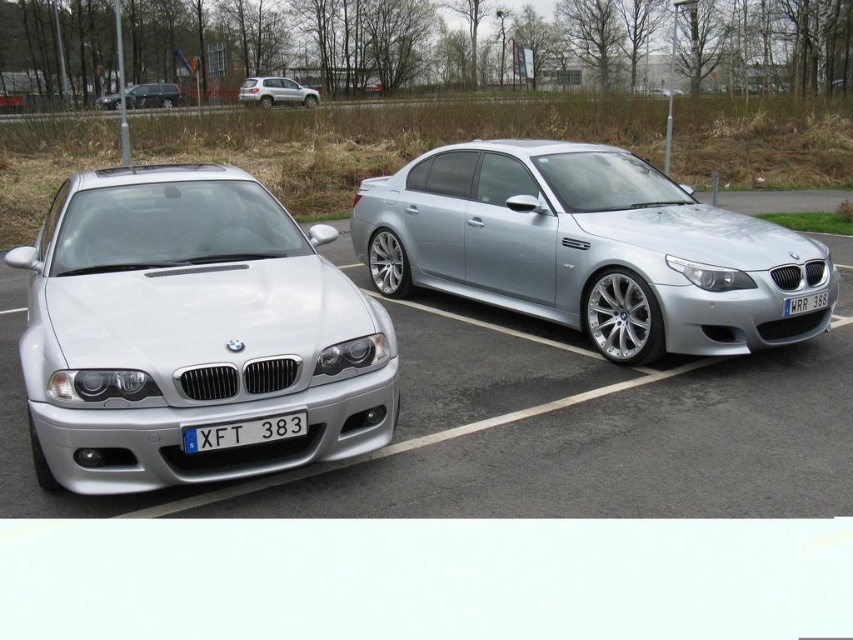
Is satin silver sedan at center shorter than blue metallic license plate at lower center?

In fact, satin silver sedan at center may be taller than blue metallic license plate at lower center.

The width and height of the screenshot is (853, 640). What do you see at coordinates (589, 248) in the screenshot? I see `satin silver sedan at center` at bounding box center [589, 248].

You are a GUI agent. You are given a task and a screenshot of the screen. Output one action in this format:
    pyautogui.click(x=<x>, y=<y>)
    Task: Click on the satin silver sedan at center
    The image size is (853, 640).
    Given the screenshot: What is the action you would take?
    pyautogui.click(x=589, y=248)

What are the coordinates of `satin silver sedan at center` in the screenshot? It's located at (589, 248).

Between point (187, 449) and point (306, 97), which one is positioned behind?

The point (306, 97) is behind.

Who is more forward, (x=233, y=420) or (x=271, y=84)?

Point (x=233, y=420) is in front.

Image resolution: width=853 pixels, height=640 pixels. Identify the location of blue metallic license plate at lower center. (242, 433).

Who is more forward, (668, 192) or (283, 90)?

Point (668, 192) is in front.

Where is `satin silver sedan at center`? This screenshot has height=640, width=853. satin silver sedan at center is located at coordinates (589, 248).

Between point (611, 301) and point (241, 86), which one is positioned behind?

Point (241, 86)

I want to click on satin silver sedan at center, so click(589, 248).